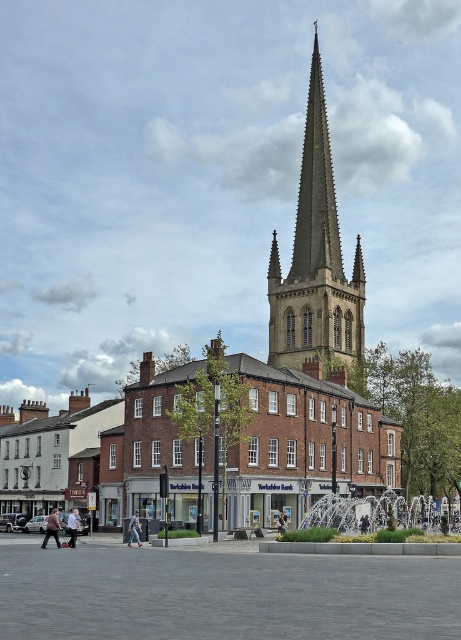
You are standing in the square and see the smooth stone spire at center and the denim jacket at lower center. Which object is located to the right of the other?

The smooth stone spire at center is positioned on the right side of denim jacket at lower center.

You are standing in the square and want to take a photo of the church spire. The camera you have can only focus on objects within 150 meters. Is the point where you are standing, which is at coordinates point (281, 316), within the focus range of the camera?

The distance of point (281, 316) from the camera is 142.06 meters, which is within the 150 meters focus range. Therefore, the camera can focus on the church spire from that point.

You are standing at the center of the square and want to take a photo of the smooth stone spire at center. Which direction should you face to capture it in your camera?

You should face towards the background direction to capture the smooth stone spire at center, as it is located at point (315, 259) which is in the central part of the background.